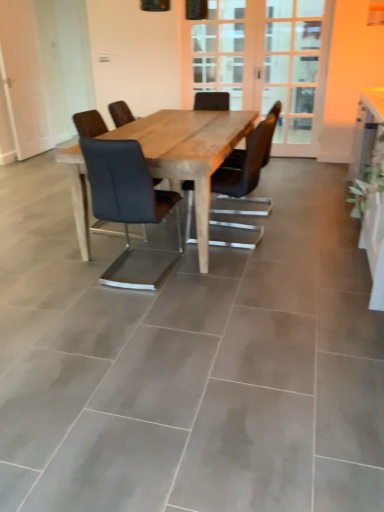
At what (x,y) coordinates should I click in order to perform the action: click on free space in front of clear glass door at upper center, the second screen door viewed from the left. Please return your answer as a coordinate pair (x, y). Image resolution: width=384 pixels, height=512 pixels. Looking at the image, I should click on (288, 161).